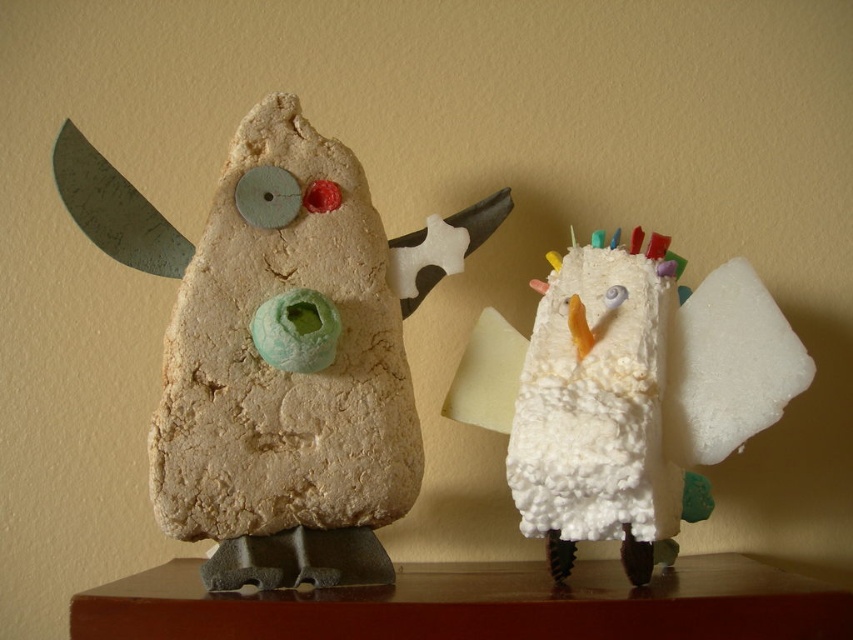
From the picture: You are an artist observing the two sculptures. Which sculpture has a thinner shape between the white fluffy bird at right and the matte clay owl at left?

The white fluffy bird at right is thinner than the matte clay owl at left.

You are a delivery robot with a 6.5 inch wide package. You need to move the package from the white fluffy bird at right to the matte clay owl at left. Can you move the package through the space between them without tilting it?

The distance between the white fluffy bird at right and the matte clay owl at left is 7.30 inches. Since the package is 6.5 inches wide, it can fit through the space between them without tilting.

You are standing in front of the wooden surface with the two sculptures. If you want to touch both the white fluffy bird at right and the matte clay owl at left, which one would you need to step forward to reach?

You would need to step forward to reach the matte clay owl at left because it is further away from you compared to the white fluffy bird at right, which is closer.